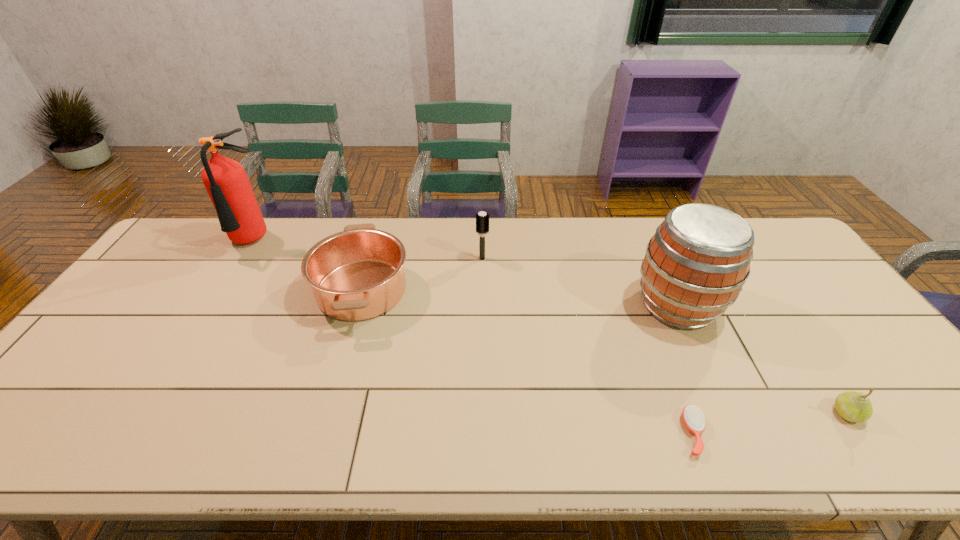
Locate an element on the screen. This screenshot has width=960, height=540. vacant area that lies between the taller hairbrush and the pear is located at coordinates (664, 336).

The width and height of the screenshot is (960, 540). Find the location of `free space between the pear and the fifth shortest object`. free space between the pear and the fifth shortest object is located at coordinates (762, 359).

Where is `vacant area between the farther hairbrush and the cider`? The image size is (960, 540). vacant area between the farther hairbrush and the cider is located at coordinates (580, 281).

This screenshot has width=960, height=540. What are the coordinates of `vacant space that's between the saucepan and the second tallest object` in the screenshot? It's located at (519, 297).

Where is `free space between the leftmost object and the rightmost object`? Image resolution: width=960 pixels, height=540 pixels. free space between the leftmost object and the rightmost object is located at coordinates (550, 328).

Where is `unoccupied area between the nearer hairbrush and the tallest object`? This screenshot has height=540, width=960. unoccupied area between the nearer hairbrush and the tallest object is located at coordinates (473, 338).

Locate which object is the closest to the fifth shortest object. Please provide its 2D coordinates. Your answer should be formatted as a tuple, i.e. [(x, y)], where the tuple contains the x and y coordinates of a point satisfying the conditions above.

[(693, 418)]

Identify the location of object that is the fifth closest to the taller hairbrush. (853, 406).

Image resolution: width=960 pixels, height=540 pixels. I want to click on free space that satisfies the following two spatial constraints: 1. on the front side of the shorter hairbrush; 2. on the left side of the saucepan, so click(321, 433).

In order to click on vacant space that satisfies the following two spatial constraints: 1. at the nozzle of the shortest object; 2. on the right side of the leftmost object in this screenshot , I will do `click(134, 433)`.